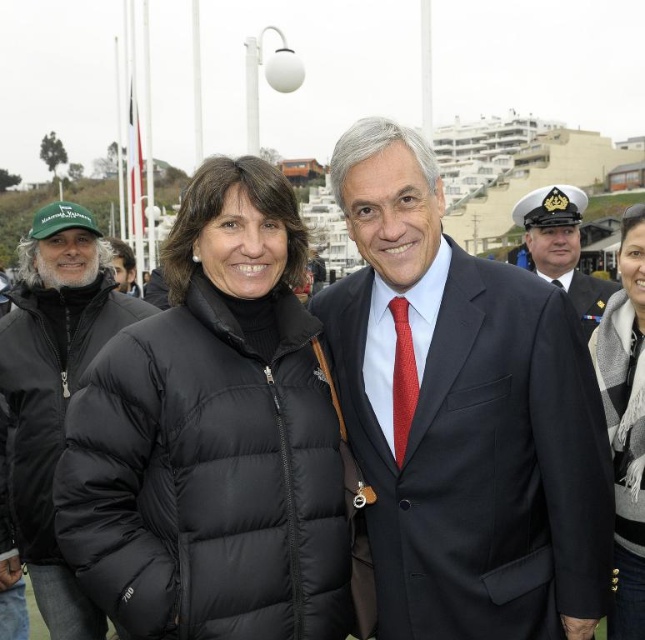
Based on the coordinates provided, which object in the scene is positioned at point (x=50, y=396)?

The black puffer jacket at left is positioned at point (x=50, y=396).

You are a photographer trying to capture a closeup of the black wool scarf at right. Given that your camera has a focal length of 50mm and you are currently 3 meters away from the subject, will you need to move closer or farther away to ensure the scarf fills the frame properly?

The black wool scarf at right is positioned at point (626, 422), which indicates it is near the bottom right corner of the frame. To fill the frame with the scarf, you would need to move closer to the subject.

You are taking a photo of the two people in the scene. The first person is at point [626,429] and the second person is at point [134,284]. Which person is closer to the camera?

Point [626,429] is closer to the camera than point [134,284].